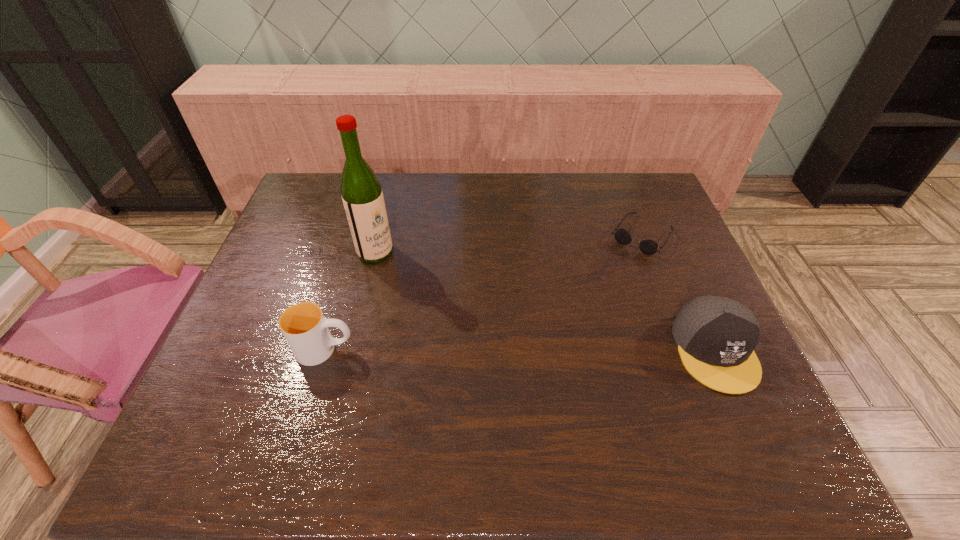
This screenshot has height=540, width=960. In order to click on cup in this screenshot , I will do `click(305, 328)`.

Find the location of a particular element. cap is located at coordinates (716, 336).

At what (x,y) coordinates should I click in order to perform the action: click on liquor. Please return your answer as a coordinate pair (x, y). This screenshot has width=960, height=540. Looking at the image, I should click on (362, 196).

Where is `the shortest object`? the shortest object is located at coordinates (649, 247).

I want to click on vacant space located with the handle on the side of the cup, so click(477, 349).

What are the coordinates of `vacant space located 0.100m on the label of the liquor` in the screenshot? It's located at (410, 278).

The width and height of the screenshot is (960, 540). What are the coordinates of `free spot located on the label of the liquor` in the screenshot? It's located at (405, 274).

Find the location of a particular element. The image size is (960, 540). free location located on the label of the liquor is located at coordinates (491, 334).

This screenshot has width=960, height=540. What are the coordinates of `vacant space positioned 0.400m on the front-facing side of the sunglasses` in the screenshot? It's located at coord(563,348).

At what (x,y) coordinates should I click in order to perform the action: click on free region located on the front-facing side of the sunglasses. Please return your answer as a coordinate pair (x, y). The width and height of the screenshot is (960, 540). Looking at the image, I should click on (604, 291).